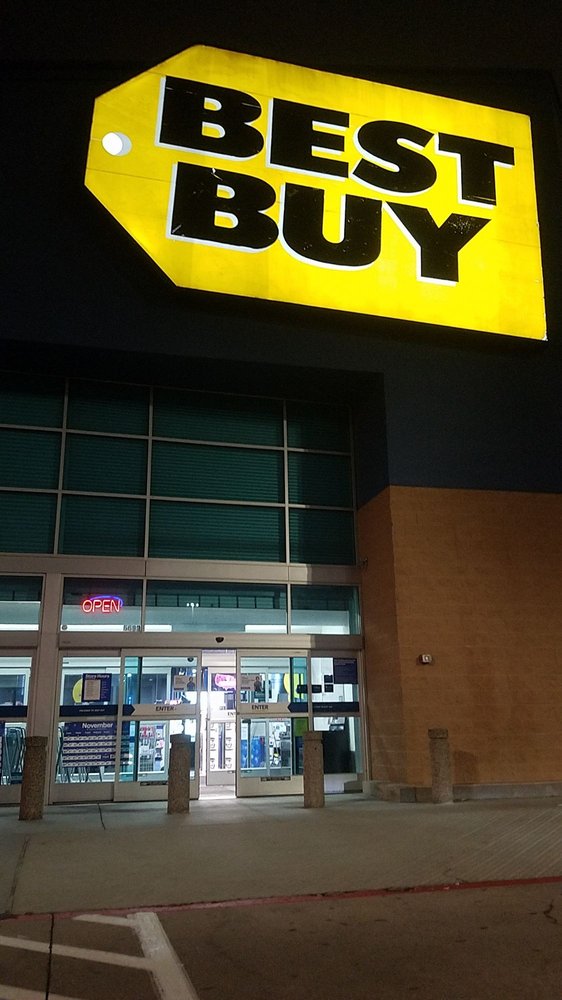
Locate an element on the screen. door is located at coordinates (274, 711), (170, 710).